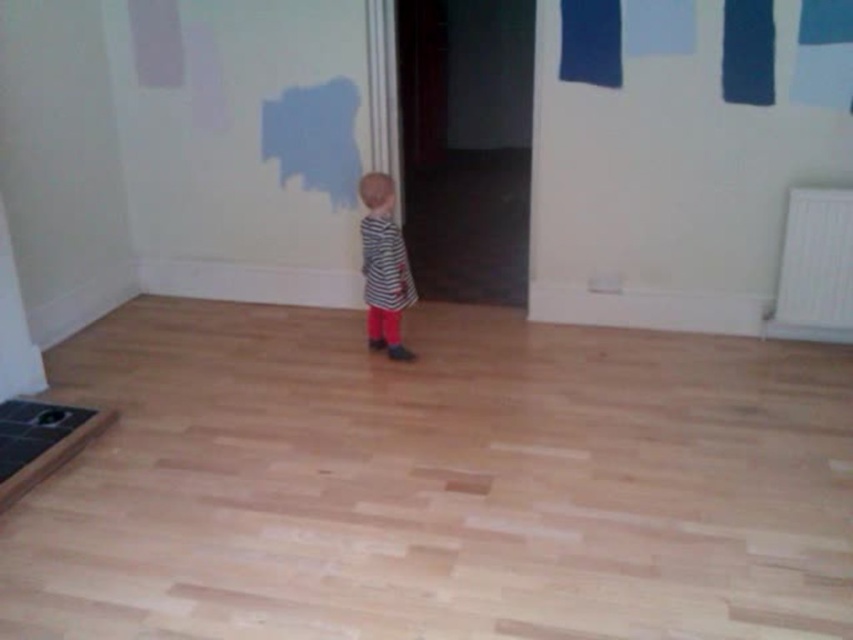
Who is more forward, (602,22) or (387,268)?

Point (387,268) is in front.

Is dark blue fabric at upper right to the right of striped fabric dress at center from the viewer's perspective?

Correct, you'll find dark blue fabric at upper right to the right of striped fabric dress at center.

At what (x,y) coordinates should I click in order to perform the action: click on dark blue fabric at upper right. Please return your answer as a coordinate pair (x, y). The width and height of the screenshot is (853, 640). Looking at the image, I should click on (619, 35).

Who is more distant from viewer, [809,259] or [381,284]?

Point [809,259]

Who is shorter, white plastic radiator at right or striped fabric dress at center?

Standing shorter between the two is white plastic radiator at right.

Where is `white plastic radiator at right`? The height and width of the screenshot is (640, 853). white plastic radiator at right is located at coordinates (815, 268).

Is dark blue fabric at upper right taller than white plastic radiator at right?

Incorrect, dark blue fabric at upper right's height is not larger of white plastic radiator at right's.

Measure the distance between dark blue fabric at upper right and white plastic radiator at right.

dark blue fabric at upper right is 28.14 inches from white plastic radiator at right.

Describe the element at coordinates (619, 35) in the screenshot. The image size is (853, 640). I see `dark blue fabric at upper right` at that location.

At what (x,y) coordinates should I click in order to perform the action: click on dark blue fabric at upper right. Please return your answer as a coordinate pair (x, y). Looking at the image, I should click on (619, 35).